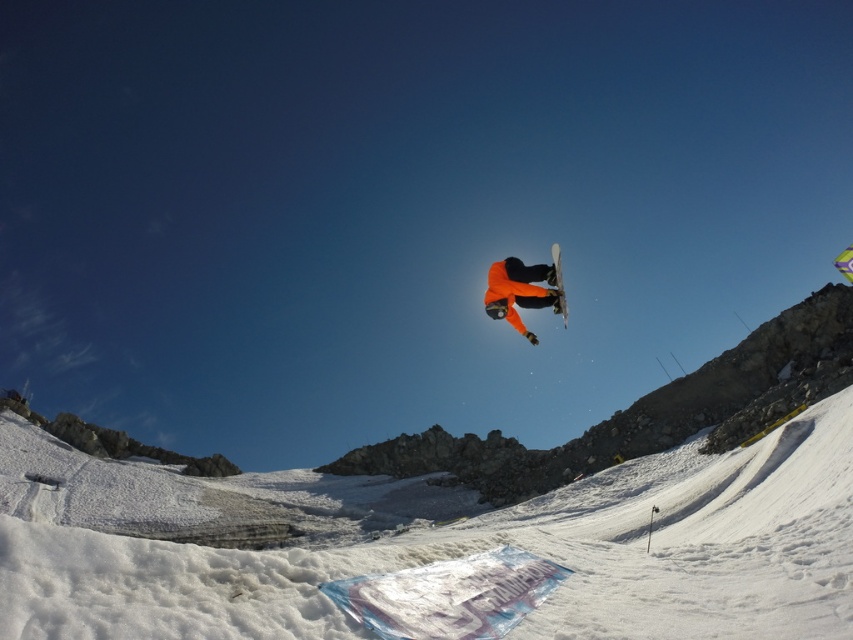
Does point (521, 333) lie in front of point (556, 289)?

That is False.

Measure the distance between orange matte snowboarder at center and camera.

orange matte snowboarder at center and camera are 119.84 meters apart from each other.

Identify the location of orange matte snowboarder at center. (519, 291).

Does white powdery snow at center have a lesser height compared to orange matte snowboarder at center?

No.

Find the location of a particular element. This screenshot has width=853, height=640. white powdery snow at center is located at coordinates (433, 544).

Is white powdery snow at center smaller than white matte snowboard at center?

Incorrect, white powdery snow at center is not smaller in size than white matte snowboard at center.

The image size is (853, 640). I want to click on white powdery snow at center, so click(x=433, y=544).

Measure the distance between point (697, 515) and camera.

Point (697, 515) is 463.82 feet from camera.

Find the location of `white powdery snow at center`. white powdery snow at center is located at coordinates (433, 544).